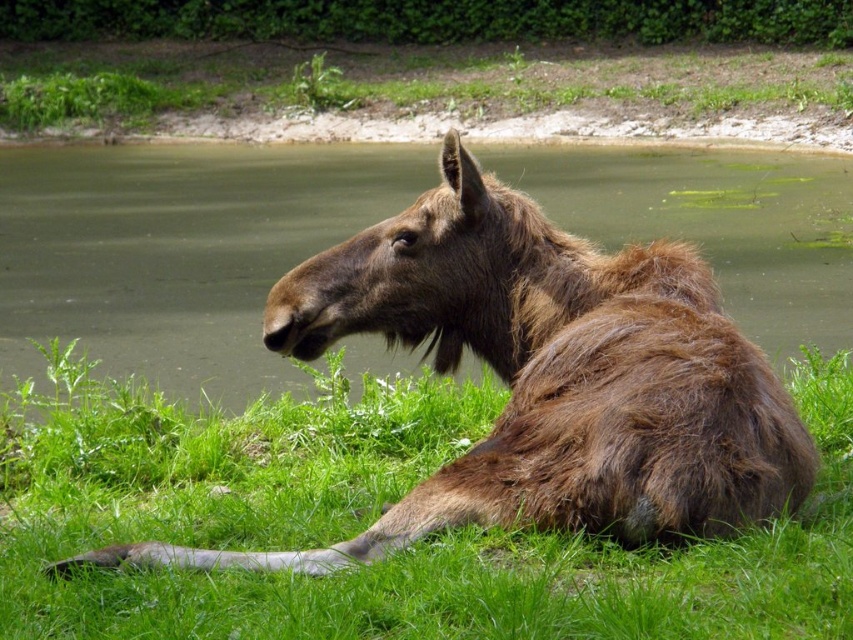
You are a hiker who wants to cross the water body shown in the image. You notice two areas of green grass, the green soft grass at lower center and the green grass at upper center. Which area of grass is shorter and more suitable for walking through without getting your shoes wet?

The green soft grass at lower center is not as tall as green grass at upper center, so it is shorter and more suitable for walking through without getting your shoes wet.

You are a hiker who wants to cross from the green grass at upper center to the green soft grass at lower center. The path between them is straight. Your backpack weighs 10 kg. Can you safely make this crossing?

The distance between the green grass at upper center and green soft grass at lower center is 15.76 meters. Since the path is straight and there are no obstacles mentioned, you can safely cross the 15.76 meters distance with your 10 kg backpack.

You are a photographer trying to capture the brown furry moose at center and the green grass at upper center in the same frame. Based on their sizes, which object should you focus on first to ensure both are in focus?

The brown furry moose at center is smaller than the green grass at upper center, so you should focus on the green grass at upper center first to ensure both are in focus.